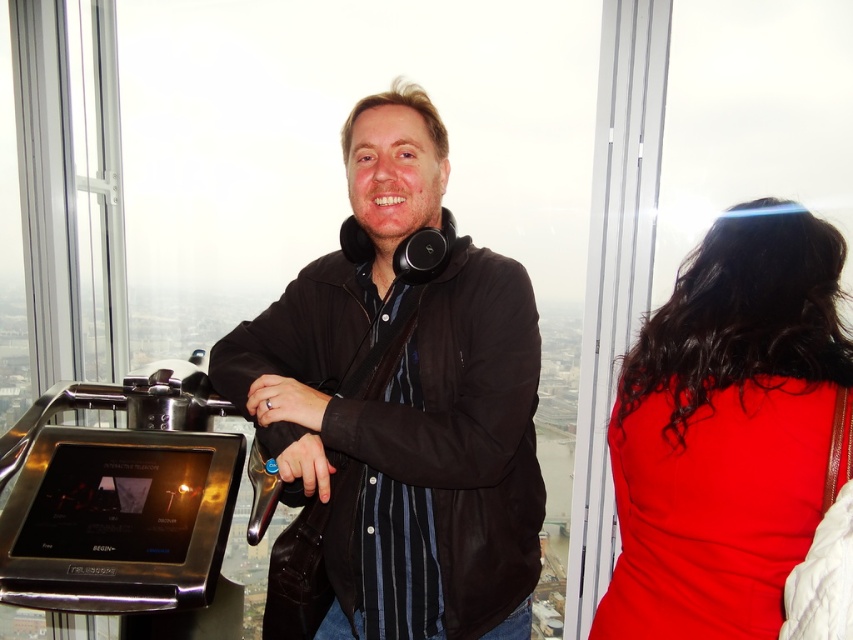
You are a fashion designer observing the two outfits in the scene. Which outfit is shorter in height between the black matte jacket at center and the shiny red dress at right?

The black matte jacket at center has a lesser height compared to the shiny red dress at right, so the black matte jacket at center is shorter in height.